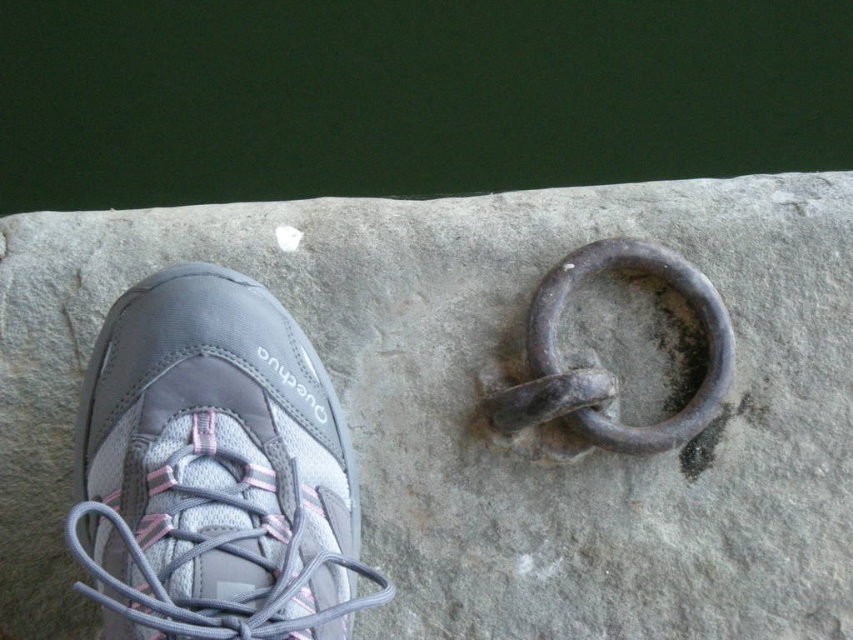
Question: Does gray fabric shoe at left lie behind rusty metal ring at center?

Choices:
 (A) yes
 (B) no

Answer: (B)

Question: Is gray stone ring at center below gray fabric shoe at left?

Choices:
 (A) no
 (B) yes

Answer: (A)

Question: Observing the image, what is the correct spatial positioning of gray fabric shoe at left in reference to rusty metal ring at center?

Choices:
 (A) left
 (B) right

Answer: (A)

Question: Based on their relative distances, which object is nearer to the gray fabric shoe at left?

Choices:
 (A) gray stone ring at center
 (B) rusty metal ring at center

Answer: (A)

Question: Based on their relative distances, which object is nearer to the rusty metal ring at center?

Choices:
 (A) gray stone ring at center
 (B) gray fabric shoe at left

Answer: (A)

Question: Which point is farther to the camera?

Choices:
 (A) gray stone ring at center
 (B) rusty metal ring at center

Answer: (A)